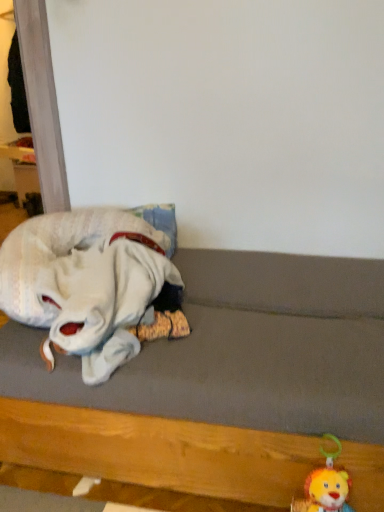
Question: Can you confirm if fluffy plush lion at lower right, which is the second toy from left to right, is smaller than wooden bed frame at lower left?

Choices:
 (A) yes
 (B) no

Answer: (A)

Question: Is fluffy plush lion at lower right, which is the second toy from left to right, taller than wooden bed frame at lower left?

Choices:
 (A) no
 (B) yes

Answer: (A)

Question: Would you say fluffy plush lion at lower right, the first toy from the right, contains wooden bed frame at lower left?

Choices:
 (A) no
 (B) yes

Answer: (A)

Question: From the image's perspective, is fluffy plush lion at lower right, which is the second toy from left to right, located beneath wooden bed frame at lower left?

Choices:
 (A) no
 (B) yes

Answer: (B)

Question: Does fluffy plush lion at lower right, which is the second toy from left to right, have a lesser height compared to wooden bed frame at lower left?

Choices:
 (A) no
 (B) yes

Answer: (B)

Question: Would you consider fluffy plush lion at lower right, the 1th toy ordered from the bottom, to be distant from wooden bed frame at lower left?

Choices:
 (A) no
 (B) yes

Answer: (A)

Question: Is wooden bed frame at lower left looking in the opposite direction of white plush toy at left, marked as the second toy in a bottom-to-top arrangement?

Choices:
 (A) no
 (B) yes

Answer: (A)

Question: Is wooden bed frame at lower left shorter than white plush toy at left, placed as the 1th toy when sorted from top to bottom?

Choices:
 (A) yes
 (B) no

Answer: (B)

Question: Would you say white plush toy at left, the second toy viewed from the right, is part of wooden bed frame at lower left's contents?

Choices:
 (A) no
 (B) yes

Answer: (B)

Question: Can you confirm if wooden bed frame at lower left is thinner than white plush toy at left, the second toy viewed from the right?

Choices:
 (A) no
 (B) yes

Answer: (A)

Question: Is wooden bed frame at lower left aimed at white plush toy at left, marked as the second toy in a bottom-to-top arrangement?

Choices:
 (A) no
 (B) yes

Answer: (A)

Question: From a real-world perspective, is wooden bed frame at lower left over white plush toy at left, placed as the 1th toy when sorted from top to bottom?

Choices:
 (A) yes
 (B) no

Answer: (B)

Question: Considering the relative sizes of white plush toy at left, placed as the 1th toy when sorted from top to bottom, and wooden bed frame at lower left in the image provided, is white plush toy at left, placed as the 1th toy when sorted from top to bottom, wider than wooden bed frame at lower left?

Choices:
 (A) no
 (B) yes

Answer: (A)